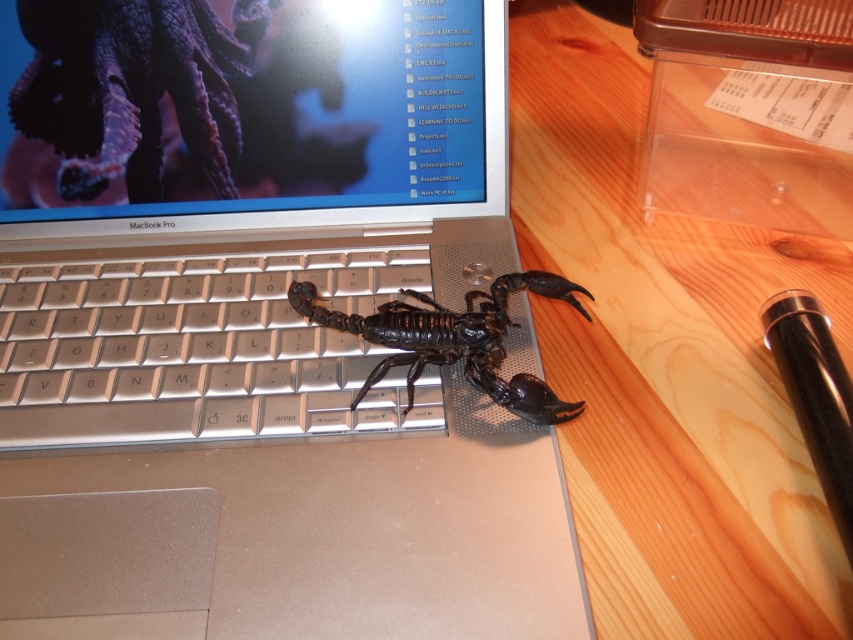
You are a user trying to place a black metallic pen at right on the desk without blocking the glossy plastic screen at upper center. Based on their positions, can you confirm if placing the pen to the right of the screen would keep it from covering the screen?

The glossy plastic screen at upper center is positioned on the left side of black metallic pen at right, so placing the pen to the right of the screen would keep it from covering the screen.

You are a delivery robot trying to place a small package on the desk. The package must be placed exactly at the point with coordinates point (258,326). However, there is a satin silver laptop at center on the desk. Can you safely place the package at that point without disturbing the laptop?

The point (258,326) corresponds to the satin silver laptop at center, so placing the package there would directly interfere with the laptop. Choose another location on the desk.

You are holding a ruler that is 12 inches long. You want to measure the distance between the point at coordinates point (460, 83) and yourself. Can your ruler reach that point?

The distance between point (460, 83) and the viewer is 20.97 inches. Since the ruler is only 12 inches long, it cannot reach the point.